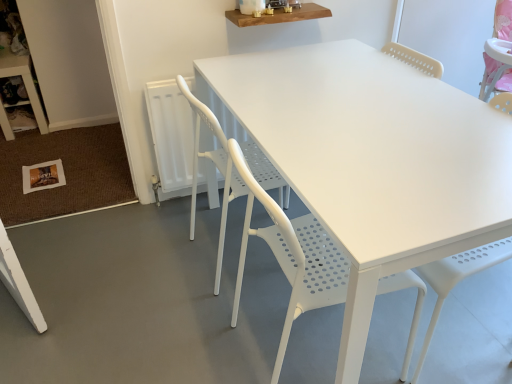
Image resolution: width=512 pixels, height=384 pixels. In order to click on free spot below white perforated plastic chair at center, arranged as the first chair when viewed from the front (from a real-world perspective) in this screenshot , I will do `click(307, 345)`.